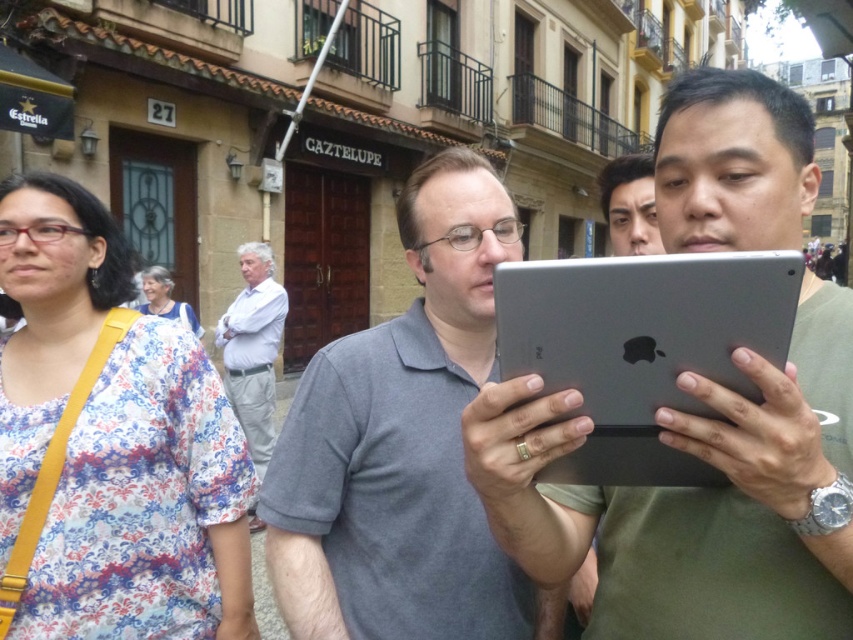
How much distance is there between satin silver tablet at center and matte black face at upper center?

8.44 feet

Measure the distance from satin silver tablet at center to matte black face at upper center.

satin silver tablet at center is 2.57 meters away from matte black face at upper center.

Who is more distant from viewer, (676, 600) or (631, 209)?

The point (631, 209) is behind.

Where is `satin silver tablet at center`? Image resolution: width=853 pixels, height=640 pixels. satin silver tablet at center is located at coordinates (694, 497).

Can you confirm if matte gray tablet at center is positioned to the right of white cotton shirt at center?

Correct, you'll find matte gray tablet at center to the right of white cotton shirt at center.

Can you confirm if matte gray tablet at center is positioned below white cotton shirt at center?

Incorrect, matte gray tablet at center is not positioned below white cotton shirt at center.

You are a GUI agent. You are given a task and a screenshot of the screen. Output one action in this format:
    pyautogui.click(x=<x>, y=<y>)
    Task: Click on the matte gray tablet at center
    The width and height of the screenshot is (853, 640).
    Given the screenshot: What is the action you would take?
    pyautogui.click(x=401, y=442)

Between floral fabric blouse at left and silver metallic tablet at center, which one appears on the right side from the viewer's perspective?

From the viewer's perspective, silver metallic tablet at center appears more on the right side.

Is floral fabric blouse at left bigger than silver metallic tablet at center?

Correct, floral fabric blouse at left is larger in size than silver metallic tablet at center.

This screenshot has height=640, width=853. What do you see at coordinates (109, 442) in the screenshot?
I see `floral fabric blouse at left` at bounding box center [109, 442].

The width and height of the screenshot is (853, 640). Identify the location of floral fabric blouse at left. click(x=109, y=442).